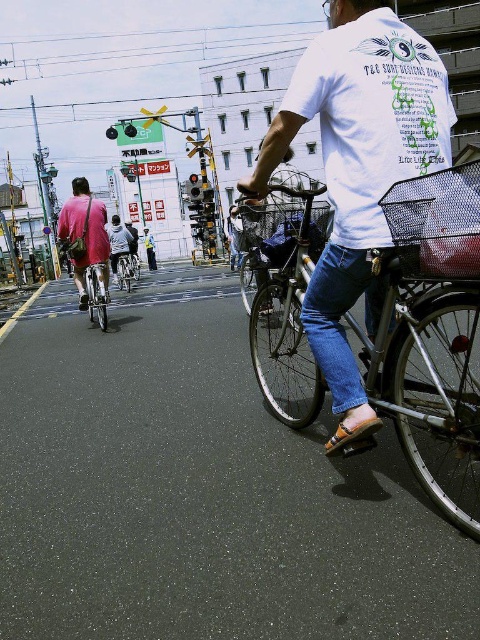
Question: Which object is the closest to the silver metallic bicycle at center?

Choices:
 (A) metallic mesh basket at center
 (B) light gray fabric jacket at center
 (C) shiny silver bicycle at left
 (D) light blue jeans at center

Answer: (B)

Question: Is white cotton t-shirt at center to the left of light blue jeans at center from the viewer's perspective?

Choices:
 (A) no
 (B) yes

Answer: (A)

Question: Among these objects, which one is farthest from the camera?

Choices:
 (A) metallic wire basket at center
 (B) light blue jeans at center
 (C) silver metallic bicycle at center

Answer: (B)

Question: Which point is closer to the camera?

Choices:
 (A) metallic wire basket at center
 (B) metallic mesh basket at center

Answer: (B)

Question: Is silver metallic bicycle at center further to camera compared to light blue jeans at center?

Choices:
 (A) no
 (B) yes

Answer: (A)

Question: Can you confirm if metallic silver bicycle at center is bigger than silver metallic bicycle at center?

Choices:
 (A) no
 (B) yes

Answer: (B)